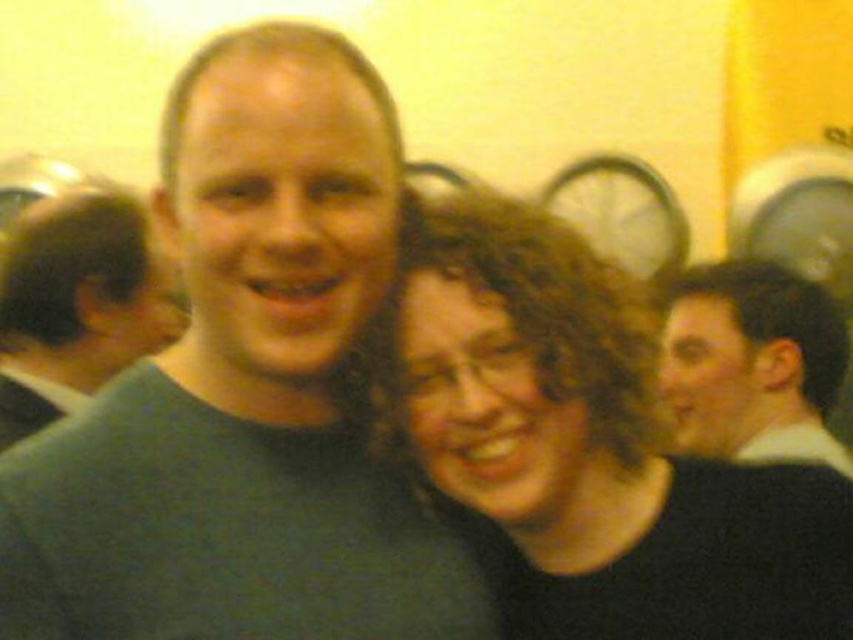
You are a photographer who wants to adjust the lighting to highlight the dark green sweater at left. Where should you place the light source relative to the point marked at coordinates (76, 305)?

The dark green sweater at left is located at point (76, 305). To highlight it, place the light source directly above this point to ensure proper illumination.

You are a photographer who wants to ensure that both the dark green sweater at left and the light brown hair at right are clearly visible in your photo. Based on the scene description, which object should be closer to the camera to ensure proper focus?

The dark green sweater at left is positioned on the left side of light brown hair at right. Since the background is slightly out of focus with a shallow depth of field, the photographer should ensure that both objects are within the focal plane. However, if only one can be prioritized, the object closer to the camera would be in focus. Since the dark green sweater at left is on the left side, it might be closer, but without exact distance data, adjust focus to include both within the depth of field range.

You are a photographer trying to capture a group photo of the black matte hair at center and the light brown hair at right. Based on their current positions, which person should you instruct to move to the left to ensure both are centered in the frame?

The light brown hair at right should move to the left because the black matte hair at center is already positioned to its left, so shifting the right individual leftward would help center them both.